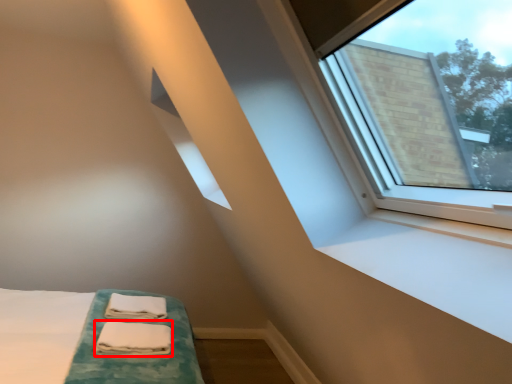
Question: From the image's perspective, what is the correct spatial relationship of sheet (annotated by the red box) in relation to bath towel?

Choices:
 (A) above
 (B) below

Answer: (B)